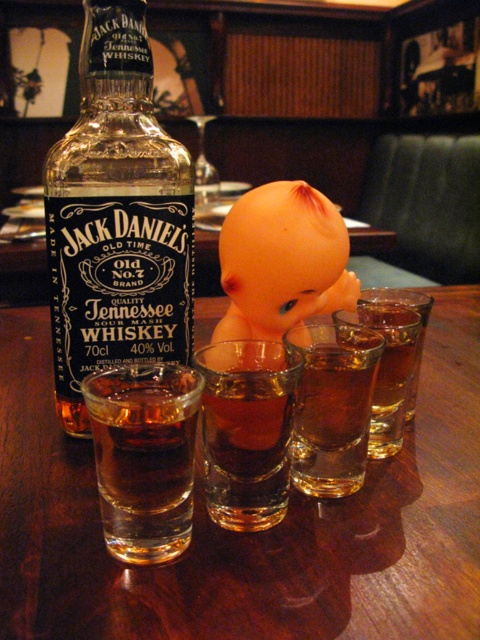
Measure the distance between transparent glass table at center and translucent glass shot glass at center.

transparent glass table at center and translucent glass shot glass at center are 6.21 inches apart.

Between transparent glass table at center and translucent glass shot glass at center, which one has more height?

transparent glass table at center is taller.

Is point (301, 552) farther from viewer compared to point (372, 417)?

No.

The image size is (480, 640). Find the location of `transparent glass table at center`. transparent glass table at center is located at coordinates (250, 532).

Is point (346, 308) closer to viewer compared to point (336, 452)?

No, it is behind (336, 452).

Who is more distant from viewer, (331, 204) or (342, 332)?

The point (342, 332) is behind.

This screenshot has height=640, width=480. I want to click on matte orange baby doll at center, so click(x=282, y=260).

Can you confirm if transparent glass table at center is positioned below amber liquid at center?

Incorrect, transparent glass table at center is not positioned below amber liquid at center.

Does transparent glass table at center lie in front of amber liquid at center?

Yes, it is.

Where is `transparent glass table at center`? This screenshot has width=480, height=640. transparent glass table at center is located at coordinates (250, 532).